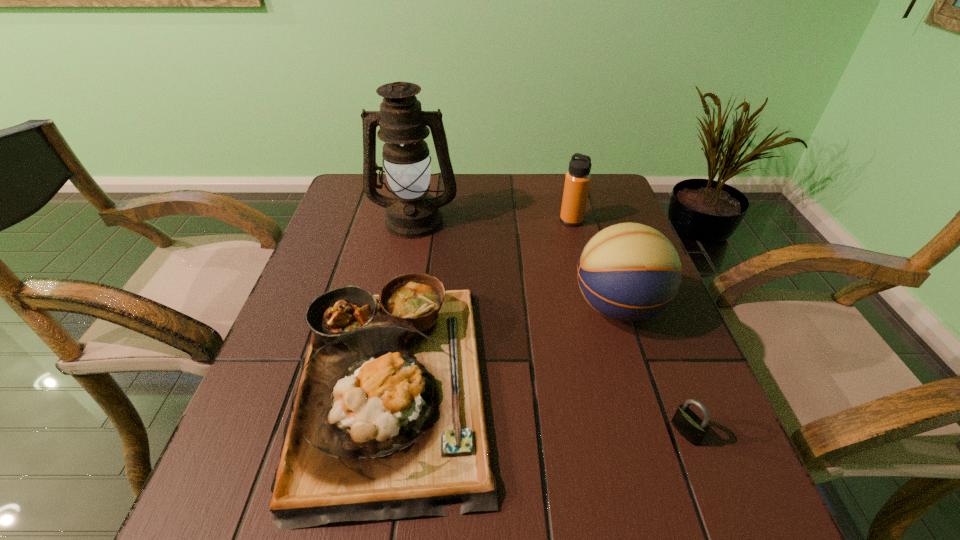
Find the location of `oil lamp`. oil lamp is located at coordinates (412, 213).

You are a GUI agent. You are given a task and a screenshot of the screen. Output one action in this format:
    pyautogui.click(x=<x>, y=<y>)
    Task: Click on the basketball
    This screenshot has width=960, height=540.
    Given the screenshot: What is the action you would take?
    pyautogui.click(x=628, y=272)

Where is `thermos bottle`? thermos bottle is located at coordinates (577, 181).

The height and width of the screenshot is (540, 960). Identify the location of platter. (388, 421).

You are a GUI agent. You are given a task and a screenshot of the screen. Output one action in this format:
    pyautogui.click(x=<x>, y=<y>)
    Task: Click on the padlock
    
    Given the screenshot: What is the action you would take?
    pyautogui.click(x=687, y=423)

Locate an element on the screen. This screenshot has height=540, width=960. vacant space located on the front of the oil lamp is located at coordinates (408, 251).

The image size is (960, 540). Find the location of `free spot located 0.150m on the patterned surface of the basketball`. free spot located 0.150m on the patterned surface of the basketball is located at coordinates (502, 307).

This screenshot has height=540, width=960. Find the location of `free space located on the patterned surface of the basketball`. free space located on the patterned surface of the basketball is located at coordinates (525, 307).

The image size is (960, 540). I want to click on free space located 0.320m on the patterned surface of the basketball, so click(x=423, y=307).

This screenshot has height=540, width=960. In order to click on vacant region located on the right of the thermos bottle in this screenshot , I will do `click(616, 221)`.